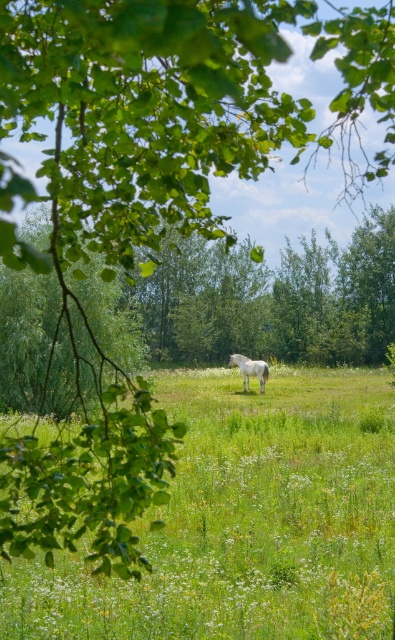
You are standing at the origin point in the image. Where is the green grassy pasture at center located in terms of coordinates?

The green grassy pasture at center is located at coordinates point (246, 522).

Looking at this image, you are a photographer wanting to capture the white glossy horse at center in the image. Since the green grassy pasture at center is also present, will the horse be easily visible against the background?

The green grassy pasture at center is larger in size than the white glossy horse at center, but since the horse is white and the pasture is green, the color contrast ensures the horse will be easily visible against the background.